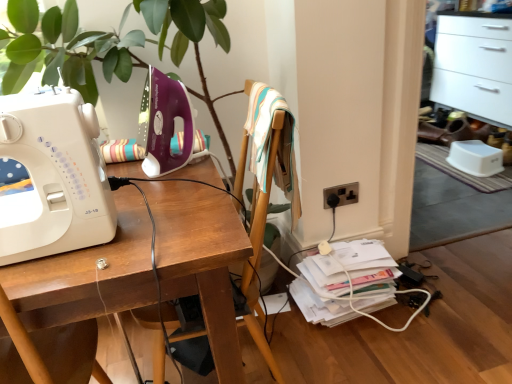
At what (x,y) coordinates should I click in order to perform the action: click on unoccupied area in front of white plastic sewing machine at left, the first sewing machine positioned from the front. Please return your answer as a coordinate pair (x, y). This screenshot has height=384, width=512. Looking at the image, I should click on (52, 268).